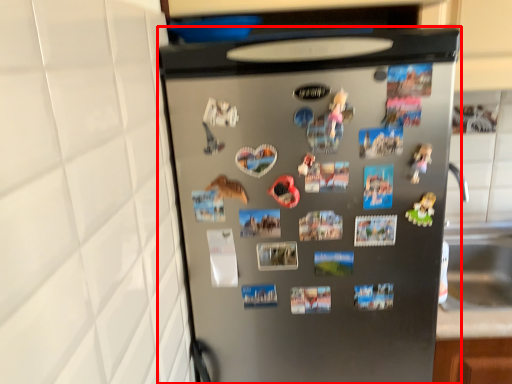
Question: From the image's perspective, what is the correct spatial positioning of refrigerator (annotated by the red box) in reference to toy?

Choices:
 (A) below
 (B) above

Answer: (A)